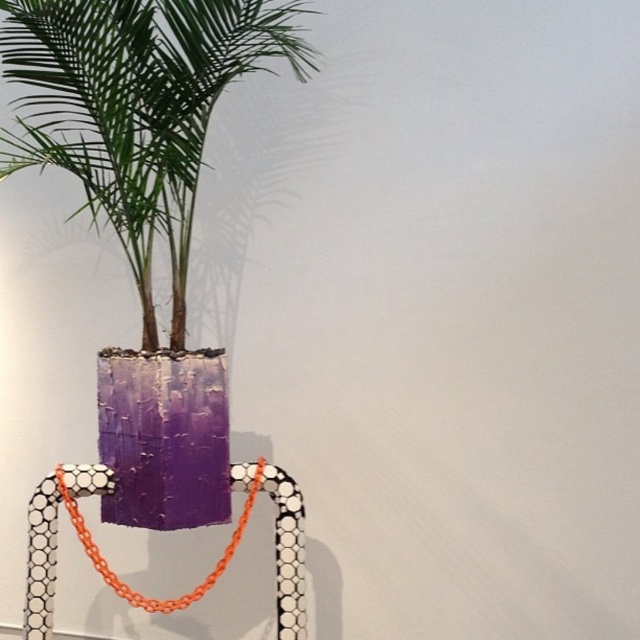
Question: Does purple textured planter at center have a lesser width compared to orange plastic necklace at center?

Choices:
 (A) no
 (B) yes

Answer: (A)

Question: Which point is closer to the camera taking this photo?

Choices:
 (A) (163, 3)
 (B) (260, 458)

Answer: (A)

Question: Is purple textured planter at center above orange plastic necklace at center?

Choices:
 (A) yes
 (B) no

Answer: (A)

Question: Is purple textured planter at center above orange plastic necklace at center?

Choices:
 (A) yes
 (B) no

Answer: (A)